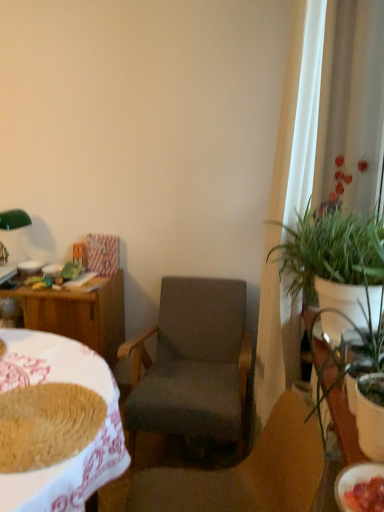
Locate an element on the screen. vacant point above wooden table at left, which is counted as the 1th table, starting from the back (from a real-world perspective) is located at coordinates click(x=56, y=277).